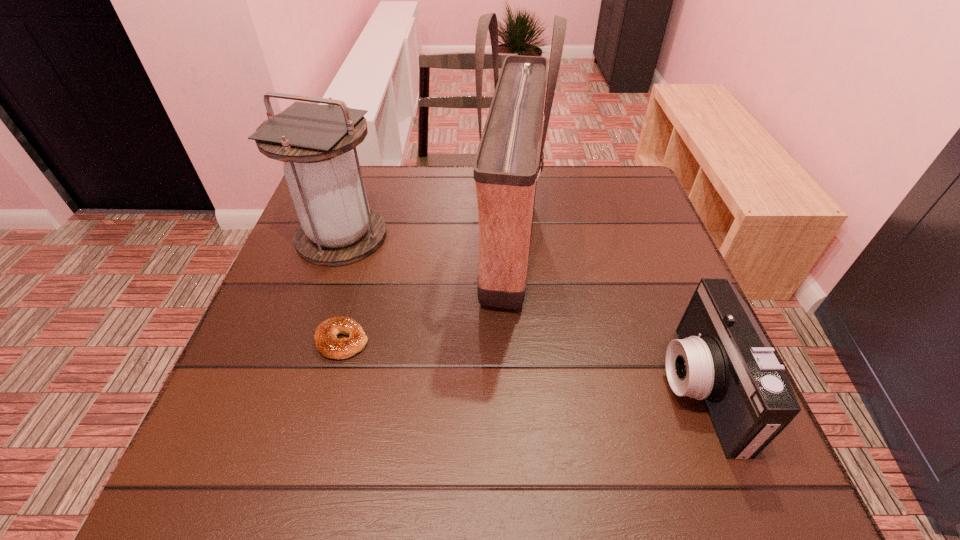
You are a GUI agent. You are given a task and a screenshot of the screen. Output one action in this format:
    pyautogui.click(x=<x>, y=<y>)
    Task: Click on the free point at the far edge
    
    Given the screenshot: What is the action you would take?
    pyautogui.click(x=396, y=199)

At what (x,y) coordinates should I click in order to perform the action: click on free region at the near edge. Please return your answer as a coordinate pair (x, y). The image size is (960, 540). Looking at the image, I should click on (379, 495).

Identify the location of vacant space at the left edge of the desktop. This screenshot has height=540, width=960. (280, 339).

Identify the location of free space at the right edge of the desktop. (648, 323).

This screenshot has height=540, width=960. Identify the location of vacant space at the far right corner. (630, 197).

In the image, there is a desktop. Identify the location of vacant space at the near right corner. (777, 495).

You are a GUI agent. You are given a task and a screenshot of the screen. Output one action in this format:
    pyautogui.click(x=<x>, y=<y>)
    Task: Click on the free space between the shortest object and the third shortest object
    This screenshot has height=540, width=960.
    Given the screenshot: What is the action you would take?
    pyautogui.click(x=342, y=288)

Where is `free space that is in between the bagel and the shopping bag`? free space that is in between the bagel and the shopping bag is located at coordinates (426, 295).

You are a GUI agent. You are given a task and a screenshot of the screen. Output one action in this format:
    pyautogui.click(x=<x>, y=<y>)
    Task: Click on the free spot between the rightmost object and the shortest object
    
    Given the screenshot: What is the action you would take?
    pyautogui.click(x=520, y=364)

Identify the location of vacant region between the lantern and the shortest object. Image resolution: width=960 pixels, height=540 pixels. (342, 288).